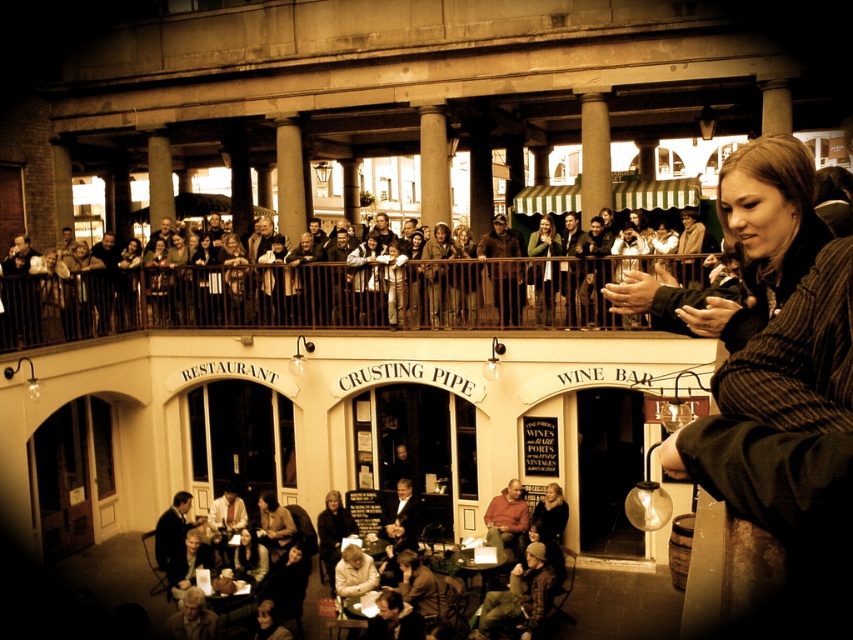
Question: Among these points, which one is nearest to the camera?

Choices:
 (A) (0, 310)
 (B) (535, 269)

Answer: (A)

Question: Which point is farther to the camera?

Choices:
 (A) brown leather jacket at upper center
 (B) green fabric jacket at upper center

Answer: (B)

Question: Is brown leather jacket at upper center wider than green fabric jacket at upper center?

Choices:
 (A) no
 (B) yes

Answer: (B)

Question: Observing the image, what is the correct spatial positioning of brown leather jacket at upper center in reference to green fabric jacket at upper center?

Choices:
 (A) below
 (B) above

Answer: (A)

Question: Is brown leather jacket at upper center closer to camera compared to green fabric jacket at upper center?

Choices:
 (A) no
 (B) yes

Answer: (B)